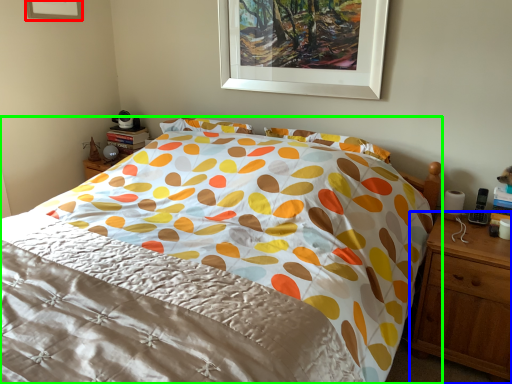
Question: Which object is positioned closest to picture frame (highlighted by a red box)? Select from nightstand (highlighted by a blue box) and bed (highlighted by a green box).

Choices:
 (A) nightstand
 (B) bed

Answer: (B)